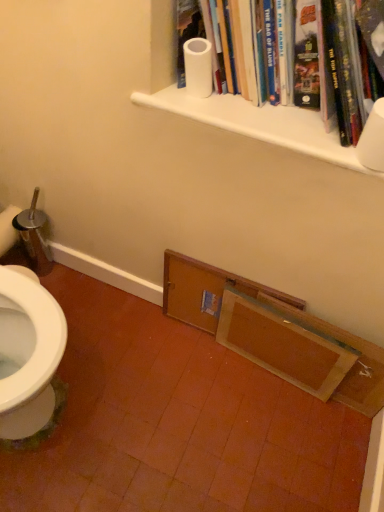
Find the location of a particular element. The height and width of the screenshot is (512, 384). white matte toilet paper at upper right, the first toilet paper when ordered from bottom to top is located at coordinates (373, 139).

I want to click on white matte paper towel roll at upper center, so click(336, 71).

Measure the distance between point (337, 101) and camera.

Point (337, 101) and camera are 32.83 inches apart.

Identify the location of white matte toilet paper at upper center, marked as the second toilet paper in a front-to-back arrangement. (198, 67).

The image size is (384, 512). I want to click on wooden door at lower center, arranged as the first shelf when viewed from the back, so click(205, 291).

Locate an element on the screen. Image resolution: width=384 pixels, height=512 pixels. white matte toilet paper at upper right, which is the second toilet paper in top-to-bottom order is located at coordinates (373, 139).

Is white matte toilet paper at upper right, which is the second toilet paper in top-to-bottom order, touching white matte toilet paper at upper center, marked as the second toilet paper in a front-to-back arrangement?

white matte toilet paper at upper right, which is the second toilet paper in top-to-bottom order, and white matte toilet paper at upper center, marked as the second toilet paper in a front-to-back arrangement, are not in contact.

How many degrees apart are the facing directions of white matte toilet paper at upper right, which ranks as the 1th toilet paper in right-to-left order, and white matte toilet paper at upper center, marked as the second toilet paper in a front-to-back arrangement?

They differ by 0.00787 degrees in their facing directions.

Considering the relative sizes of white matte toilet paper at upper right, which is the second toilet paper in top-to-bottom order, and white matte toilet paper at upper center, the 2th toilet paper when ordered from bottom to top, in the image provided, is white matte toilet paper at upper right, which is the second toilet paper in top-to-bottom order, shorter than white matte toilet paper at upper center, the 2th toilet paper when ordered from bottom to top,?

In fact, white matte toilet paper at upper right, which is the second toilet paper in top-to-bottom order, may be taller than white matte toilet paper at upper center, the 2th toilet paper when ordered from bottom to top.

Identify the location of toilet paper that is on the right side of white matte toilet paper at upper center, which is the 1th toilet paper in top-to-bottom order. (373, 139).

Where is `shelf above the wooden door at lower center, arranged as the first shelf when viewed from the back (from the image's perspective)`? The height and width of the screenshot is (512, 384). shelf above the wooden door at lower center, arranged as the first shelf when viewed from the back (from the image's perspective) is located at coordinates (259, 124).

Is wooden door at lower center, acting as the second shelf starting from the top, facing away from white matte shelf at upper center, arranged as the second shelf when ordered from the bottom?

No, wooden door at lower center, acting as the second shelf starting from the top, is not facing away from white matte shelf at upper center, arranged as the second shelf when ordered from the bottom.

From the image's perspective, which object appears higher, wooden door at lower center, which is the first shelf in bottom-to-top order, or white matte shelf at upper center, which is counted as the 2th shelf, starting from the back?

white matte shelf at upper center, which is counted as the 2th shelf, starting from the back, from the image's perspective.

Who is taller, wooden door at lower center, which is the first shelf in bottom-to-top order, or white matte shelf at upper center, which is counted as the 2th shelf, starting from the back?

wooden door at lower center, which is the first shelf in bottom-to-top order, is taller.

Considering the sizes of objects white matte toilet paper at upper center, which is the 1th toilet paper in top-to-bottom order, and wooden frame at lower center in the image provided, who is bigger, white matte toilet paper at upper center, which is the 1th toilet paper in top-to-bottom order, or wooden frame at lower center?

Bigger between the two is wooden frame at lower center.

Is point (211, 56) closer or farther from the camera than point (264, 315)?

Point (211, 56).

In the scene shown: Is white matte toilet paper at upper center, marked as the second toilet paper in a front-to-back arrangement, spatially inside wooden frame at lower center, or outside of it?

white matte toilet paper at upper center, marked as the second toilet paper in a front-to-back arrangement, lies outside wooden frame at lower center.

From a real-world perspective, is wooden door at lower center, the second shelf viewed from the front, positioned above or below white matte toilet paper at upper center, the 1th toilet paper viewed from the left?

Clearly, from a real-world perspective, wooden door at lower center, the second shelf viewed from the front, is below white matte toilet paper at upper center, the 1th toilet paper viewed from the left.

Measure the distance from wooden door at lower center, the second shelf viewed from the front, to white matte toilet paper at upper center, the second toilet paper positioned from the right.

23.85 inches.

Who is bigger, wooden door at lower center, the second shelf viewed from the front, or white matte toilet paper at upper center, the 1th toilet paper viewed from the back?

Bigger between the two is wooden door at lower center, the second shelf viewed from the front.

Is white matte shelf at upper center, arranged as the second shelf when ordered from the bottom, oriented towards white matte paper towel roll at upper center?

No, white matte shelf at upper center, arranged as the second shelf when ordered from the bottom, does not turn towards white matte paper towel roll at upper center.

Which point is more forward, [233,115] or [328,1]?

The point [328,1] is more forward.

Is white matte shelf at upper center, placed as the first shelf when sorted from top to bottom, positioned behind white matte paper towel roll at upper center?

Yes, it is.

In the scene shown: How many degrees apart are the facing directions of white matte shelf at upper center, which is counted as the first shelf, starting from the front, and white matte paper towel roll at upper center?

white matte shelf at upper center, which is counted as the first shelf, starting from the front, and white matte paper towel roll at upper center are facing 0.235 degrees away from each other.

Which is closer to the camera, (256, 351) or (211, 286)?

The point (211, 286) is in front.

Does wooden frame at lower center appear on the left side of wooden door at lower center, arranged as the first shelf when viewed from the back?

In fact, wooden frame at lower center is to the right of wooden door at lower center, arranged as the first shelf when viewed from the back.

Is wooden frame at lower center next to wooden door at lower center, which is the first shelf in bottom-to-top order, and touching it?

No, wooden frame at lower center is not beside wooden door at lower center, which is the first shelf in bottom-to-top order.

Is wooden frame at lower center facing away from wooden door at lower center, the second shelf viewed from the front?

Yes, wooden frame at lower center's orientation is away from wooden door at lower center, the second shelf viewed from the front.

What's the angular difference between white matte paper towel roll at upper center and white matte shelf at upper center, placed as the first shelf when sorted from top to bottom,'s facing directions?

There is a 0.235-degree angle between the facing directions of white matte paper towel roll at upper center and white matte shelf at upper center, placed as the first shelf when sorted from top to bottom.

From a real-world perspective, which object rests below the other?

white matte shelf at upper center, which is counted as the first shelf, starting from the front, is physically lower.

Between point (347, 133) and point (325, 137), which one is positioned behind?

Positioned behind is point (325, 137).

Does white matte paper towel roll at upper center have a smaller size compared to white matte shelf at upper center, arranged as the second shelf when ordered from the bottom?

No.

I want to click on toilet paper below the white matte toilet paper at upper center, the 1th toilet paper viewed from the back (from the image's perspective), so click(373, 139).

Locate an element on the screen. shelf located above the wooden door at lower center, which is the first shelf in bottom-to-top order (from a real-world perspective) is located at coordinates (259, 124).

Estimate the real-world distances between objects in this image. Which object is closer to white matte toilet paper at upper center, marked as the second toilet paper in a front-to-back arrangement, white matte shelf at upper center, placed as the first shelf when sorted from top to bottom, or white matte toilet paper at upper right, the 2th toilet paper positioned from the back?

The object closer to white matte toilet paper at upper center, marked as the second toilet paper in a front-to-back arrangement, is white matte shelf at upper center, placed as the first shelf when sorted from top to bottom.

Which object lies further to the anchor point white matte paper towel roll at upper center, white matte toilet paper at upper right, the 2th toilet paper positioned from the back, or wooden door at lower center, acting as the second shelf starting from the top?

wooden door at lower center, acting as the second shelf starting from the top, is positioned further to the anchor white matte paper towel roll at upper center.

From the image, which object appears to be nearer to white matte toilet paper at upper right, which is the second toilet paper in top-to-bottom order, white matte shelf at upper center, arranged as the second shelf when ordered from the bottom, or white matte toilet paper at upper center, the second toilet paper positioned from the right?

white matte shelf at upper center, arranged as the second shelf when ordered from the bottom, is closer to white matte toilet paper at upper right, which is the second toilet paper in top-to-bottom order.

Considering their positions, is white matte paper towel roll at upper center positioned further to wooden frame at lower center than white matte toilet paper at upper center, the 2th toilet paper when ordered from bottom to top?

Among the two, white matte toilet paper at upper center, the 2th toilet paper when ordered from bottom to top, is located further to wooden frame at lower center.

Which object lies nearer to the anchor point white matte toilet paper at upper center, which is the 1th toilet paper in top-to-bottom order, wooden frame at lower center or white matte shelf at upper center, arranged as the second shelf when ordered from the bottom?

white matte shelf at upper center, arranged as the second shelf when ordered from the bottom, is positioned closer to the anchor white matte toilet paper at upper center, which is the 1th toilet paper in top-to-bottom order.

Considering their positions, is white matte toilet paper at upper center, which is the 1th toilet paper in top-to-bottom order, positioned further to wooden door at lower center, arranged as the first shelf when viewed from the back, than white matte toilet paper at upper right, the first toilet paper when ordered from front to back?

white matte toilet paper at upper right, the first toilet paper when ordered from front to back, is further to wooden door at lower center, arranged as the first shelf when viewed from the back.

Estimate the real-world distances between objects in this image. Which object is closer to white matte paper towel roll at upper center, white matte shelf at upper center, which is counted as the first shelf, starting from the front, or white matte toilet paper at upper center, the 1th toilet paper viewed from the back?

white matte shelf at upper center, which is counted as the first shelf, starting from the front.

Which object lies further to the anchor point white matte toilet paper at upper center, the 1th toilet paper viewed from the left, white matte shelf at upper center, which is counted as the first shelf, starting from the front, or wooden door at lower center, acting as the second shelf starting from the top?

wooden door at lower center, acting as the second shelf starting from the top.

Find the location of `book located between white matte toilet paper at upper center, the 1th toilet paper viewed from the back, and white matte toilet paper at upper right, which is the second toilet paper in top-to-bottom order, in the left-right direction`. book located between white matte toilet paper at upper center, the 1th toilet paper viewed from the back, and white matte toilet paper at upper right, which is the second toilet paper in top-to-bottom order, in the left-right direction is located at coordinates 336,71.

The image size is (384, 512). I want to click on toilet paper that lies between white matte shelf at upper center, placed as the first shelf when sorted from top to bottom, and wooden frame at lower center from top to bottom, so click(x=373, y=139).

Locate an element on the screen. shelf between white matte shelf at upper center, arranged as the second shelf when ordered from the bottom, and wooden frame at lower center, in the vertical direction is located at coordinates (205, 291).

The width and height of the screenshot is (384, 512). I want to click on toilet paper between white matte toilet paper at upper center, the 2th toilet paper when ordered from bottom to top, and wooden door at lower center, arranged as the first shelf when viewed from the back, in the up-down direction, so click(x=373, y=139).